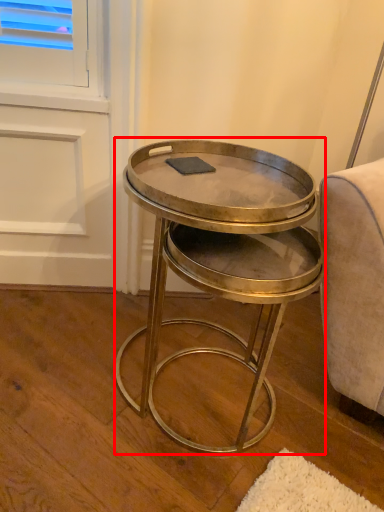
Question: Considering the relative positions of coffee table (annotated by the red box) and pad in the image provided, where is coffee table (annotated by the red box) located with respect to the staircase?

Choices:
 (A) left
 (B) right

Answer: (B)